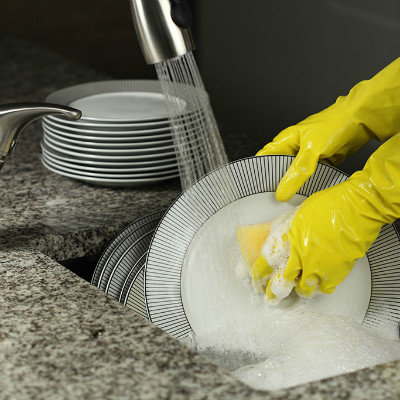
Locate an element on the screen. tap handle is located at coordinates (13, 114).